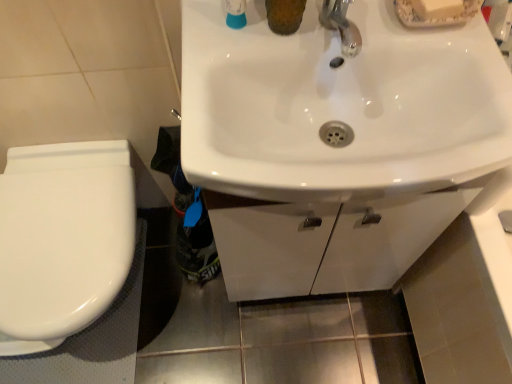
Question: From the image's perspective, relative to white glossy sink at center, is white glossy toilet at left above or below?

Choices:
 (A) above
 (B) below

Answer: (B)

Question: Considering the positions of white glossy toilet at left and white glossy sink at center in the image, is white glossy toilet at left bigger or smaller than white glossy sink at center?

Choices:
 (A) big
 (B) small

Answer: (A)

Question: Is point (66, 180) closer or farther from the camera than point (224, 175)?

Choices:
 (A) closer
 (B) farther

Answer: (B)

Question: Is point (311, 66) positioned closer to the camera than point (57, 248)?

Choices:
 (A) closer
 (B) farther

Answer: (A)

Question: In the image, is white glossy sink at center positioned in front of or behind white glossy toilet at left?

Choices:
 (A) behind
 (B) front

Answer: (B)

Question: From a real-world perspective, is white glossy sink at center positioned above or below white glossy toilet at left?

Choices:
 (A) below
 (B) above

Answer: (B)

Question: Considering the positions of white glossy sink at center and white glossy toilet at left in the image, is white glossy sink at center bigger or smaller than white glossy toilet at left?

Choices:
 (A) small
 (B) big

Answer: (A)